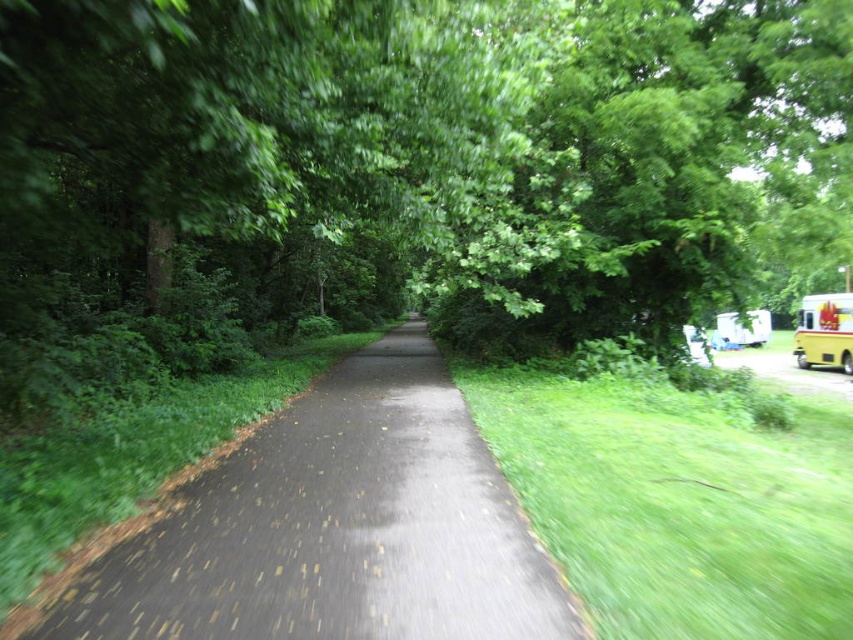
Based on the photo, is green leafy tree at center thinner than yellow matte school bus at right?

In fact, green leafy tree at center might be wider than yellow matte school bus at right.

Measure the distance between green leafy tree at center and yellow matte school bus at right.

They are 18.92 meters apart.

Image resolution: width=853 pixels, height=640 pixels. I want to click on green leafy tree at center, so 405,170.

Between point (292, 225) and point (297, 513), which one is positioned in front?

Point (297, 513)

Can you confirm if green leafy tree at center is bigger than black asphalt path at center?

Yes.

Which is behind, point (714, 22) or point (245, 573)?

The point (714, 22) is behind.

The width and height of the screenshot is (853, 640). I want to click on green leafy tree at center, so click(405, 170).

Is black asphalt path at center closer to camera compared to yellow matte school bus at right?

Yes, it is.

Find the location of a particular element. The width and height of the screenshot is (853, 640). black asphalt path at center is located at coordinates (329, 529).